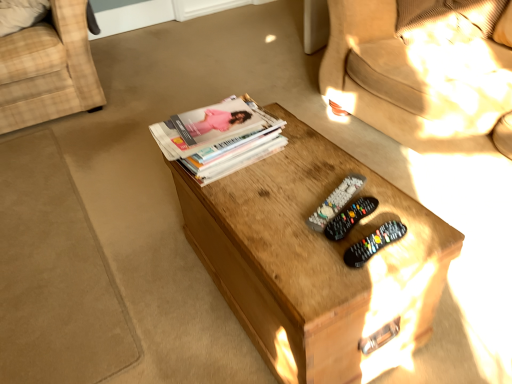
Describe the element at coordinates (316, 261) in the screenshot. This screenshot has height=384, width=512. I see `wooden coffee table at center` at that location.

The height and width of the screenshot is (384, 512). What do you see at coordinates (336, 201) in the screenshot?
I see `black plastic remote at center, marked as the 1th remote control in a back-to-front arrangement` at bounding box center [336, 201].

Where is `plaid fabric chair at left`? The height and width of the screenshot is (384, 512). plaid fabric chair at left is located at coordinates (48, 70).

What do you see at coordinates (350, 217) in the screenshot? The image size is (512, 384). I see `black plastic remote control at center, the 2th remote control positioned from the front` at bounding box center [350, 217].

The image size is (512, 384). What do you see at coordinates (221, 138) in the screenshot?
I see `white glossy magazine stack at center` at bounding box center [221, 138].

The height and width of the screenshot is (384, 512). I want to click on wooden coffee table at center, so click(x=316, y=261).

Consider the image. Between plaid fabric chair at left and wooden coffee table at center, which one has larger size?

plaid fabric chair at left.

Considering the points (57, 91) and (393, 288), which point is behind, point (57, 91) or point (393, 288)?

The point (57, 91) is behind.

Is plaid fabric chair at left not near wooden coffee table at center?

plaid fabric chair at left is far away from wooden coffee table at center.

From a real-world perspective, which remote control is the 1st one above the wooden coffee table at center? Please provide its 2D coordinates.

[(336, 201)]

Which is in front, point (348, 183) or point (248, 216)?

The point (248, 216) is in front.

Visually, is black plastic remote at center, marked as the 1th remote control in a back-to-front arrangement, positioned to the left or to the right of wooden coffee table at center?

black plastic remote at center, marked as the 1th remote control in a back-to-front arrangement, is positioned on wooden coffee table at center's right side.

Is plaid fabric chair at left not within black plastic remote control at center, the 2th remote control positioned from the front?

plaid fabric chair at left lies outside black plastic remote control at center, the 2th remote control positioned from the front,'s area.

Consider the image. From the image's perspective, is plaid fabric chair at left below black plastic remote control at center, the 2th remote control positioned from the front?

Actually, plaid fabric chair at left appears above black plastic remote control at center, the 2th remote control positioned from the front, in the image.

Considering the relative positions of plaid fabric chair at left and black plastic remote control at center, marked as the second remote control in a back-to-front arrangement, in the image provided, is plaid fabric chair at left to the left of black plastic remote control at center, marked as the second remote control in a back-to-front arrangement, from the viewer's perspective?

Yes.

Which of these two, plaid fabric chair at left or black plastic remote control at center, the 2th remote control positioned from the front, is smaller?

black plastic remote control at center, the 2th remote control positioned from the front.

From the picture: Is wooden coffee table at center far away from black plastic remote at center, which is the 3th remote control from front to back?

wooden coffee table at center is actually quite close to black plastic remote at center, which is the 3th remote control from front to back.

Which object is thinner, wooden coffee table at center or black plastic remote at center, which is the 3th remote control from front to back?

black plastic remote at center, which is the 3th remote control from front to back, is thinner.

Which is behind, wooden coffee table at center or black plastic remote at center, marked as the 1th remote control in a back-to-front arrangement?

black plastic remote at center, marked as the 1th remote control in a back-to-front arrangement, is behind.

Based on their positions, is wooden coffee table at center located to the left or right of black plastic remote at center, marked as the 1th remote control in a back-to-front arrangement?

wooden coffee table at center is positioned on black plastic remote at center, marked as the 1th remote control in a back-to-front arrangement,'s left side.

Would you say black plastic remote control at center, the 2th remote control positioned from the front, is a long distance from black plastic remote at center, marked as the 1th remote control in a back-to-front arrangement?

Actually, black plastic remote control at center, the 2th remote control positioned from the front, and black plastic remote at center, marked as the 1th remote control in a back-to-front arrangement, are a little close together.

In the scene shown: In terms of height, does black plastic remote control at center, the 2th remote control positioned from the front, look taller or shorter compared to black plastic remote at center, which is the 3th remote control from front to back?

black plastic remote control at center, the 2th remote control positioned from the front, is taller than black plastic remote at center, which is the 3th remote control from front to back.

Based on their positions, is black plastic remote control at center, the 2th remote control positioned from the front, located to the left or right of black plastic remote at center, which is the 3th remote control from front to back?

From the image, it's evident that black plastic remote control at center, the 2th remote control positioned from the front, is to the right of black plastic remote at center, which is the 3th remote control from front to back.

In the scene shown: Based on their sizes in the image, would you say black plastic remote control at center, the 2th remote control positioned from the front, is bigger or smaller than black plastic remote at center, which is the 3th remote control from front to back?

black plastic remote control at center, the 2th remote control positioned from the front, is bigger than black plastic remote at center, which is the 3th remote control from front to back.

Is point (350, 259) more distant than point (170, 155)?

That is False.

Considering the relative sizes of black plastic remote controls at center, acting as the third remote control starting from the back, and white glossy magazine stack at center in the image provided, is black plastic remote controls at center, acting as the third remote control starting from the back, taller than white glossy magazine stack at center?

Incorrect, the height of black plastic remote controls at center, acting as the third remote control starting from the back, is not larger of that of white glossy magazine stack at center.

Measure the distance from black plastic remote controls at center, which ranks as the first remote control in front-to-back order, to white glossy magazine stack at center.

black plastic remote controls at center, which ranks as the first remote control in front-to-back order, and white glossy magazine stack at center are 21.09 inches apart.

Would you say black plastic remote at center, which is the 3th remote control from front to back, is inside or outside white glossy magazine stack at center?

black plastic remote at center, which is the 3th remote control from front to back, exists outside the volume of white glossy magazine stack at center.

From the image's perspective, is black plastic remote at center, marked as the 1th remote control in a back-to-front arrangement, positioned above or below white glossy magazine stack at center?

Clearly, from the image's perspective, black plastic remote at center, marked as the 1th remote control in a back-to-front arrangement, is below white glossy magazine stack at center.

Considering their positions, is black plastic remote at center, marked as the 1th remote control in a back-to-front arrangement, located in front of or behind white glossy magazine stack at center?

In the image, black plastic remote at center, marked as the 1th remote control in a back-to-front arrangement, appears in front of white glossy magazine stack at center.

I want to click on table below the plaid fabric chair at left (from a real-world perspective), so click(x=316, y=261).

This screenshot has height=384, width=512. There is a wooden coffee table at center. Identify the location of the 1st remote control above it (from a real-world perspective). point(336,201).

Considering their positions, is wooden coffee table at center positioned closer to black plastic remote control at center, the 2th remote control positioned from the front, than white glossy magazine stack at center?

The object closer to black plastic remote control at center, the 2th remote control positioned from the front, is wooden coffee table at center.

From the image, which object appears to be nearer to black plastic remote controls at center, which ranks as the first remote control in front-to-back order, white glossy magazine stack at center or black plastic remote at center, marked as the 1th remote control in a back-to-front arrangement?

Among the two, black plastic remote at center, marked as the 1th remote control in a back-to-front arrangement, is located nearer to black plastic remote controls at center, which ranks as the first remote control in front-to-back order.

Estimate the real-world distances between objects in this image. Which object is further from wooden coffee table at center, black plastic remote control at center, the 2th remote control positioned from the front, or plaid fabric chair at left?

plaid fabric chair at left.

Considering their positions, is wooden coffee table at center positioned closer to plaid fabric chair at left than black plastic remote controls at center, acting as the third remote control starting from the back?

The object closer to plaid fabric chair at left is wooden coffee table at center.

Estimate the real-world distances between objects in this image. Which object is closer to white glossy magazine stack at center, wooden coffee table at center or plaid fabric chair at left?

Based on the image, wooden coffee table at center appears to be nearer to white glossy magazine stack at center.

Which object lies further to the anchor point black plastic remote at center, marked as the 1th remote control in a back-to-front arrangement, black plastic remote control at center, the 2th remote control positioned from the front, or plaid fabric chair at left?

The object further to black plastic remote at center, marked as the 1th remote control in a back-to-front arrangement, is plaid fabric chair at left.

Considering their positions, is wooden coffee table at center positioned closer to white glossy magazine stack at center than black plastic remote at center, which is the 3th remote control from front to back?

The object closer to white glossy magazine stack at center is wooden coffee table at center.

From the image, which object appears to be farther from plaid fabric chair at left, white glossy magazine stack at center or black plastic remote controls at center, acting as the third remote control starting from the back?

black plastic remote controls at center, acting as the third remote control starting from the back, is further to plaid fabric chair at left.

This screenshot has width=512, height=384. I want to click on table located between plaid fabric chair at left and black plastic remote control at center, marked as the second remote control in a back-to-front arrangement, in the left-right direction, so click(316, 261).

I want to click on remote control located between black plastic remote controls at center, which ranks as the first remote control in front-to-back order, and black plastic remote at center, marked as the 1th remote control in a back-to-front arrangement, in the depth direction, so click(350, 217).

You are a GUI agent. You are given a task and a screenshot of the screen. Output one action in this format:
    pyautogui.click(x=<x>, y=<y>)
    Task: Click on the book located between plaid fabric chair at left and wooden coffee table at center in the left-right direction
    This screenshot has width=512, height=384.
    Given the screenshot: What is the action you would take?
    pyautogui.click(x=221, y=138)

Identify the location of book situated between plaid fabric chair at left and black plastic remote at center, marked as the 1th remote control in a back-to-front arrangement, from left to right. The image size is (512, 384). (221, 138).